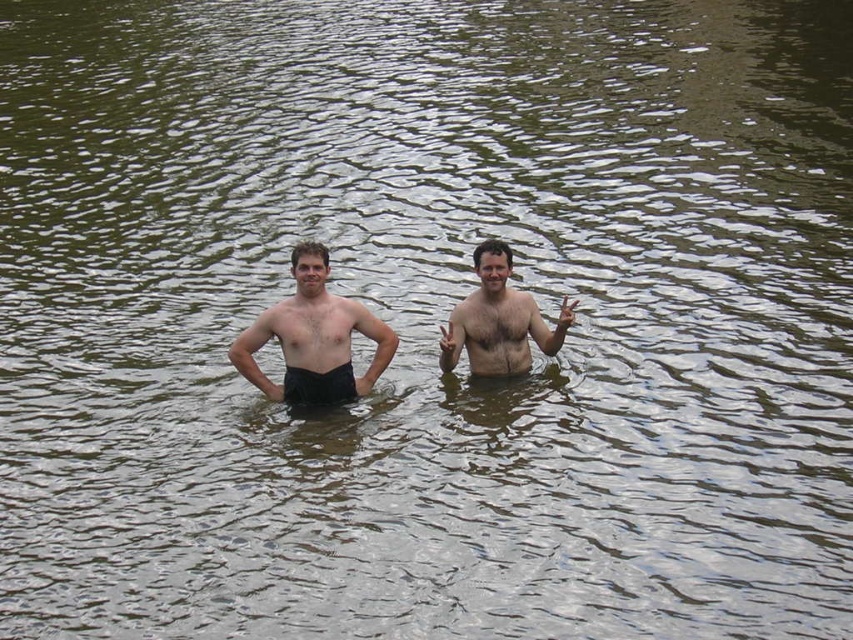
Question: Which object is the closest to the matte black shorts at center?

Choices:
 (A) smooth skin couple at center
 (B) light brown skin at center

Answer: (A)

Question: Does light brown skin at center have a lesser width compared to black cotton shorts at center?

Choices:
 (A) no
 (B) yes

Answer: (A)

Question: Which of the following is the closest to the observer?

Choices:
 (A) black cotton shorts at center
 (B) light brown skin at center
 (C) matte black shorts at center
 (D) smooth skin couple at center

Answer: (B)

Question: Is smooth skin couple at center positioned behind black cotton shorts at center?

Choices:
 (A) no
 (B) yes

Answer: (B)

Question: Estimate the real-world distances between objects in this image. Which object is farther from the smooth skin couple at center?

Choices:
 (A) black cotton shorts at center
 (B) matte black shorts at center

Answer: (A)

Question: Observing the image, what is the correct spatial positioning of matte black shorts at center in reference to black cotton shorts at center?

Choices:
 (A) above
 (B) below

Answer: (A)